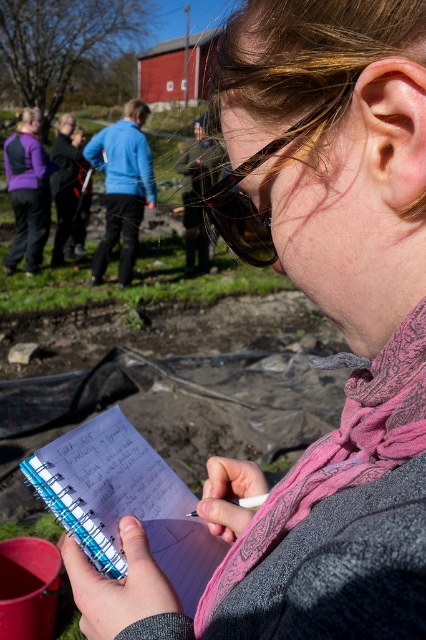
Question: Which point appears farthest from the camera in this image?

Choices:
 (A) (362, 449)
 (B) (114, 500)
 (C) (28, 184)

Answer: (C)

Question: Can you confirm if pink fabric scarf at lower center is positioned to the right of matte purple jacket at left?

Choices:
 (A) yes
 (B) no

Answer: (A)

Question: Which object appears closest to the camera in this image?

Choices:
 (A) matte purple jacket at left
 (B) pink fabric scarf at lower center
 (C) blue spiral notebook at lower center

Answer: (B)

Question: Can you confirm if pink fabric scarf at lower center is positioned to the left of black plastic goggles at center?

Choices:
 (A) yes
 (B) no

Answer: (B)

Question: Is pink fabric scarf at lower center behind black plastic goggles at center?

Choices:
 (A) no
 (B) yes

Answer: (A)

Question: Which object appears closest to the camera in this image?

Choices:
 (A) black plastic goggles at center
 (B) blue spiral notebook at lower center
 (C) matte purple jacket at left

Answer: (A)